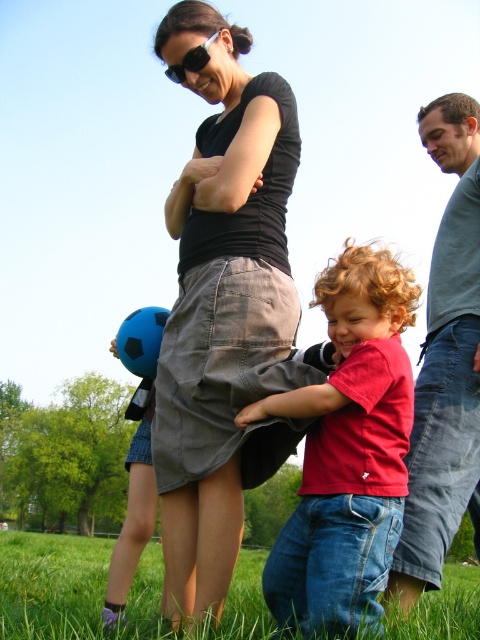
Question: Among these points, which one is nearest to the camera?

Choices:
 (A) (254, 209)
 (B) (347, 321)

Answer: (B)

Question: Which object appears closest to the camera in this image?

Choices:
 (A) matte red shirt at center
 (B) matte black shirt at center
 (C) denim jeans at right
 (D) black plastic sunglasses at upper center

Answer: (A)

Question: Which object is closer to the camera taking this photo?

Choices:
 (A) matte black shirt at center
 (B) matte red shirt at center
 (C) green grass at lower center

Answer: (B)

Question: From the image, what is the correct spatial relationship of denim jeans at right in relation to black plastic sunglasses at upper center?

Choices:
 (A) right
 (B) left

Answer: (A)

Question: Considering the relative positions of matte red shirt at center and black plastic sunglasses at upper center in the image provided, where is matte red shirt at center located with respect to black plastic sunglasses at upper center?

Choices:
 (A) above
 (B) below

Answer: (B)

Question: Does matte black shirt at center appear under green grass at lower center?

Choices:
 (A) no
 (B) yes

Answer: (A)